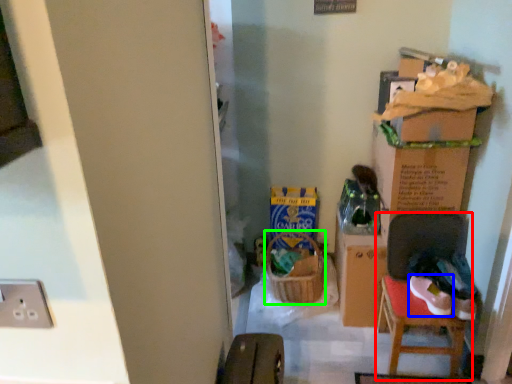
Question: Estimate the real-world distances between objects in this image. Which object is closer to chair (highlighted by a red box), footwear (highlighted by a blue box) or laundry basket (highlighted by a green box)?

Choices:
 (A) footwear
 (B) laundry basket

Answer: (A)